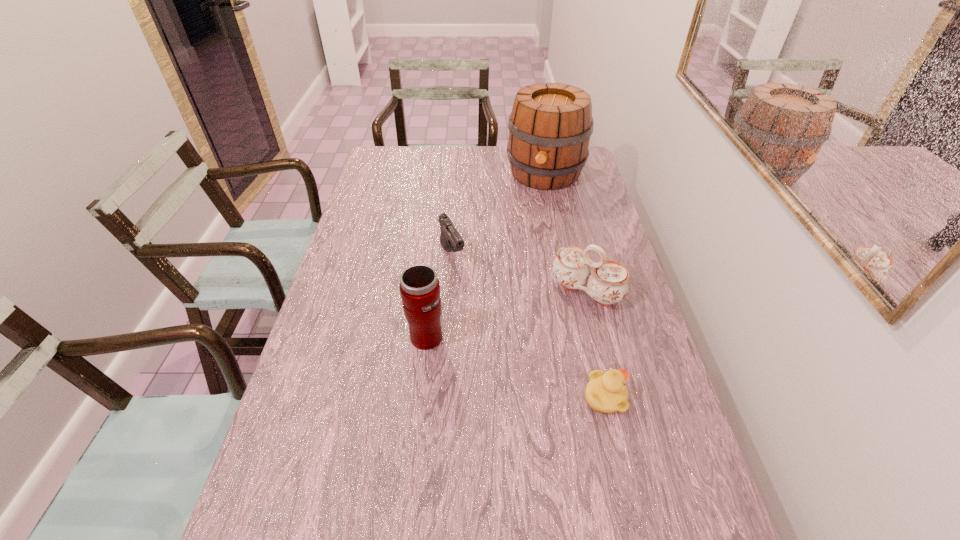
The width and height of the screenshot is (960, 540). Find the location of `free space between the pistol and the duckling`. free space between the pistol and the duckling is located at coordinates (529, 326).

Where is `the fourth closest object to the thermos bottle`? This screenshot has width=960, height=540. the fourth closest object to the thermos bottle is located at coordinates (550, 125).

The width and height of the screenshot is (960, 540). Identify the location of object that is the second closest to the pistol. tap(607, 284).

Locate an element on the screen. This screenshot has width=960, height=540. vacant space that satisfies the following two spatial constraints: 1. on the front side of the duckling; 2. on the beak of the fourth tallest object is located at coordinates (443, 397).

The image size is (960, 540). What are the coordinates of `blank space that satisfies the following two spatial constraints: 1. on the front side of the pistol; 2. on the beak of the duckling` in the screenshot? It's located at (443, 397).